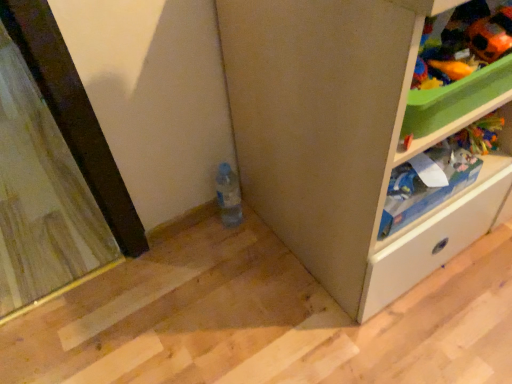
Question: Is translucent plastic bottle at lower center not near orange fabric toy at upper right, the 2th toy in the left-to-right sequence?

Choices:
 (A) no
 (B) yes

Answer: (A)

Question: From the image's perspective, is translucent plastic bottle at lower center over orange fabric toy at upper right, the 2th toy in the left-to-right sequence?

Choices:
 (A) yes
 (B) no

Answer: (B)

Question: Can you confirm if translucent plastic bottle at lower center is taller than orange fabric toy at upper right, the 2th toy in the left-to-right sequence?

Choices:
 (A) no
 (B) yes

Answer: (B)

Question: Can orange fabric toy at upper right, acting as the 1th toy starting from the right, be found inside translucent plastic bottle at lower center?

Choices:
 (A) yes
 (B) no

Answer: (B)

Question: Is translucent plastic bottle at lower center facing away from orange fabric toy at upper right, acting as the 1th toy starting from the right?

Choices:
 (A) yes
 (B) no

Answer: (B)

Question: From a real-world perspective, is translucent plastic bottle at lower center on orange fabric toy at upper right, acting as the 1th toy starting from the right?

Choices:
 (A) yes
 (B) no

Answer: (B)

Question: From a real-world perspective, is translucent plastic bottle at lower center positioned under white plastic shelf at upper right based on gravity?

Choices:
 (A) no
 (B) yes

Answer: (B)

Question: Does translucent plastic bottle at lower center have a greater height compared to white plastic shelf at upper right?

Choices:
 (A) no
 (B) yes

Answer: (B)

Question: Is translucent plastic bottle at lower center at the right side of white plastic shelf at upper right?

Choices:
 (A) yes
 (B) no

Answer: (B)

Question: Is translucent plastic bottle at lower center facing away from white plastic shelf at upper right?

Choices:
 (A) no
 (B) yes

Answer: (A)

Question: Considering the relative sizes of translucent plastic bottle at lower center and white plastic shelf at upper right in the image provided, is translucent plastic bottle at lower center smaller than white plastic shelf at upper right?

Choices:
 (A) no
 (B) yes

Answer: (B)

Question: Does translucent plastic bottle at lower center have a greater width compared to white plastic shelf at upper right?

Choices:
 (A) yes
 (B) no

Answer: (B)

Question: Is translucent plastic bottle at lower center facing away from wooden screen door at left?

Choices:
 (A) no
 (B) yes

Answer: (A)